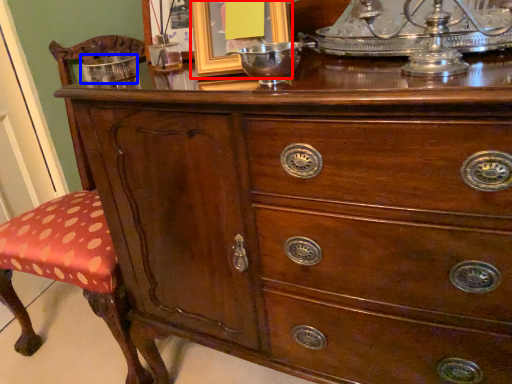
Question: Which object appears closest to the camera in this image, picture frame (highlighted by a red box) or bowl (highlighted by a blue box)?

Choices:
 (A) picture frame
 (B) bowl

Answer: (A)